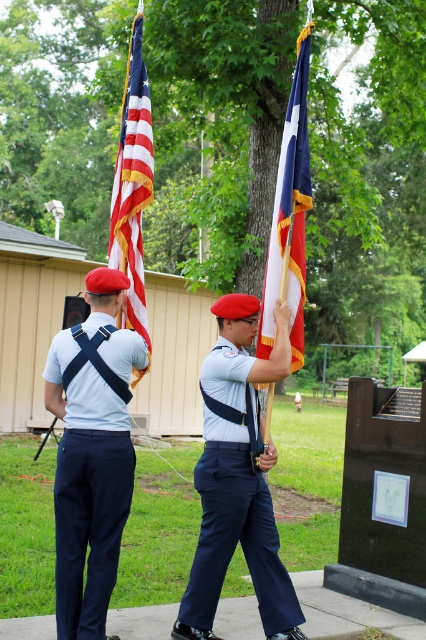
Question: Can you confirm if navy blue uniform at center is positioned above american flag at left?

Choices:
 (A) no
 (B) yes

Answer: (A)

Question: Is navy blue fabric pants at left behind american flag at left?

Choices:
 (A) yes
 (B) no

Answer: (B)

Question: Is navy blue fabric pants at left to the right of navy blue uniform at center from the viewer's perspective?

Choices:
 (A) no
 (B) yes

Answer: (A)

Question: Which point appears closest to the camera in this image?

Choices:
 (A) (301, 324)
 (B) (203, 472)

Answer: (B)

Question: Which point appears farthest from the camera in this image?

Choices:
 (A) (140, 304)
 (B) (271, 317)

Answer: (A)

Question: Based on their relative distances, which object is farther from the american flag at left?

Choices:
 (A) navy blue uniform at center
 (B) blue fabric flag at center

Answer: (A)